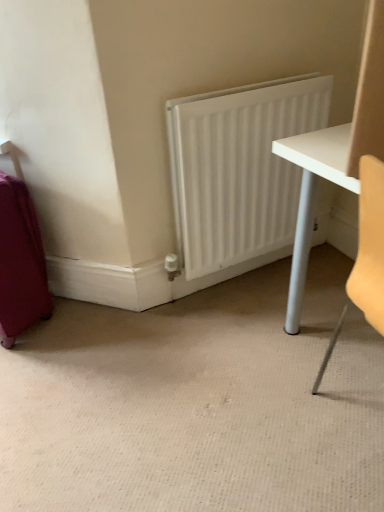
Question: From a real-world perspective, is white matte radiator at center positioned above or below matte purple suitcase at left?

Choices:
 (A) above
 (B) below

Answer: (A)

Question: Considering their positions, is white matte radiator at center located in front of or behind matte purple suitcase at left?

Choices:
 (A) front
 (B) behind

Answer: (B)

Question: Does point (261, 205) appear closer or farther from the camera than point (1, 327)?

Choices:
 (A) farther
 (B) closer

Answer: (A)

Question: Looking at their shapes, would you say matte purple suitcase at left is wider or thinner than white matte radiator at center?

Choices:
 (A) thin
 (B) wide

Answer: (B)

Question: From a real-world perspective, relative to white matte radiator at center, is matte purple suitcase at left vertically above or below?

Choices:
 (A) below
 (B) above

Answer: (A)

Question: Is matte purple suitcase at left in front of or behind white matte radiator at center in the image?

Choices:
 (A) behind
 (B) front

Answer: (B)

Question: From the image's perspective, is matte purple suitcase at left located above or below white matte radiator at center?

Choices:
 (A) above
 (B) below

Answer: (B)